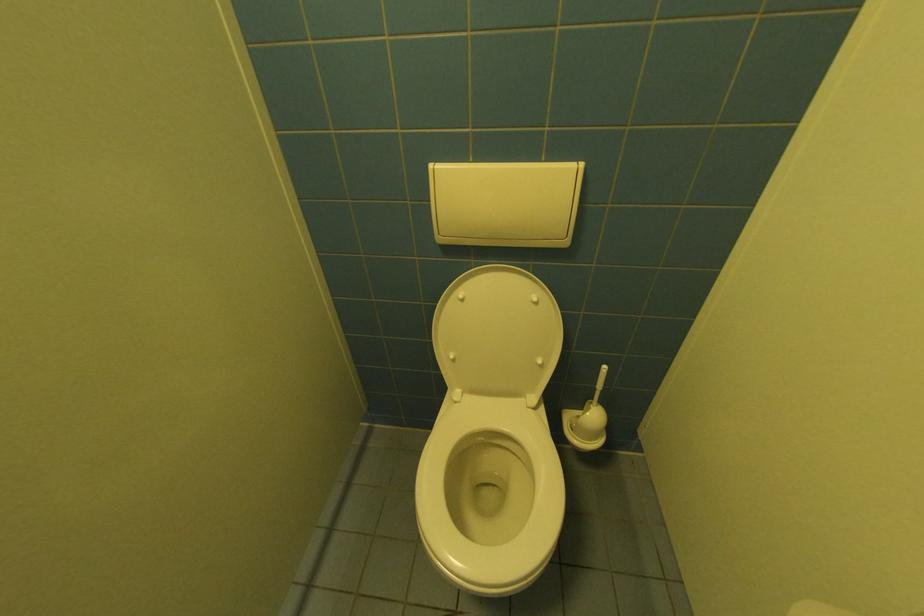
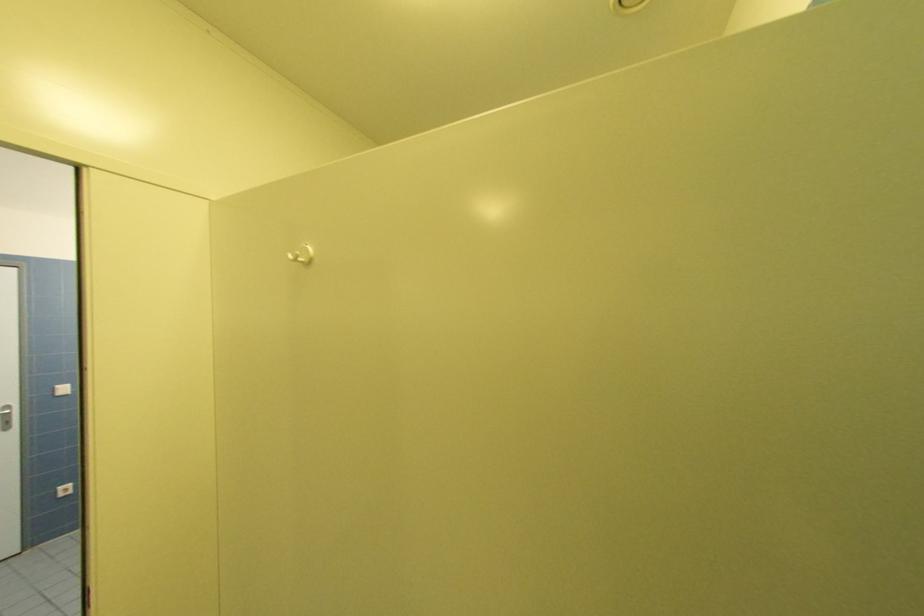
Question: The camera is either moving clockwise (left) or counter-clockwise (right) around the object. The first image is from the beginning of the video and the second image is from the end. Is the camera moving left or right when shooting the video?

Choices:
 (A) Left
 (B) Right

Answer: (B)